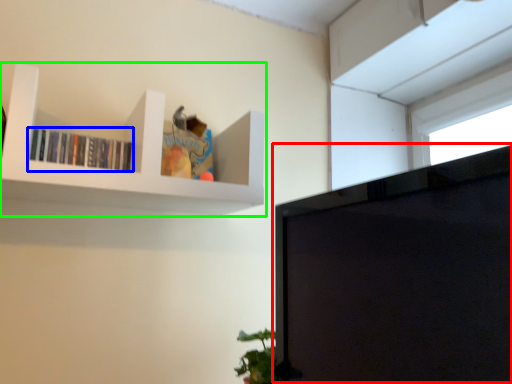
Question: Which is farther away from computer monitor (highlighted by a red box)? book (highlighted by a blue box) or shelf (highlighted by a green box)?

Choices:
 (A) book
 (B) shelf

Answer: (A)